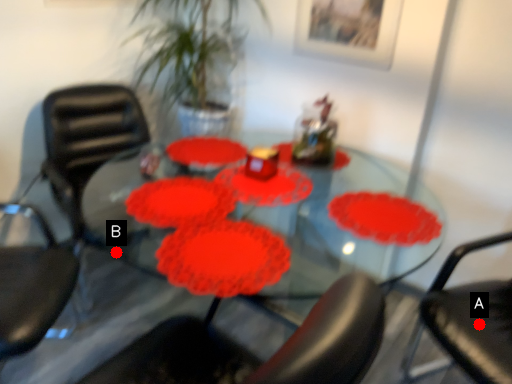
Question: Two points are circled on the image, labeled by A and B beside each circle. Which point is closer to the camera?

Choices:
 (A) A is closer
 (B) B is closer

Answer: (A)